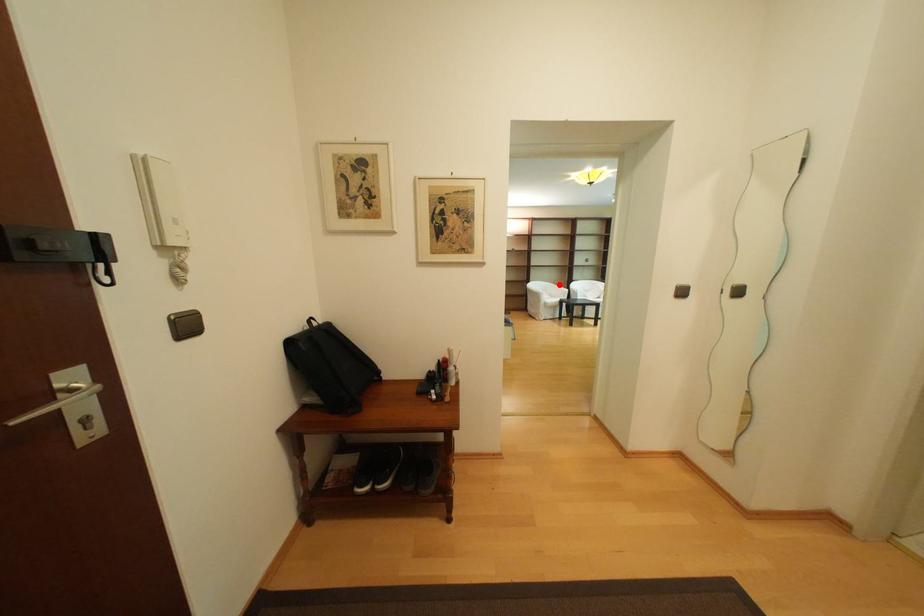
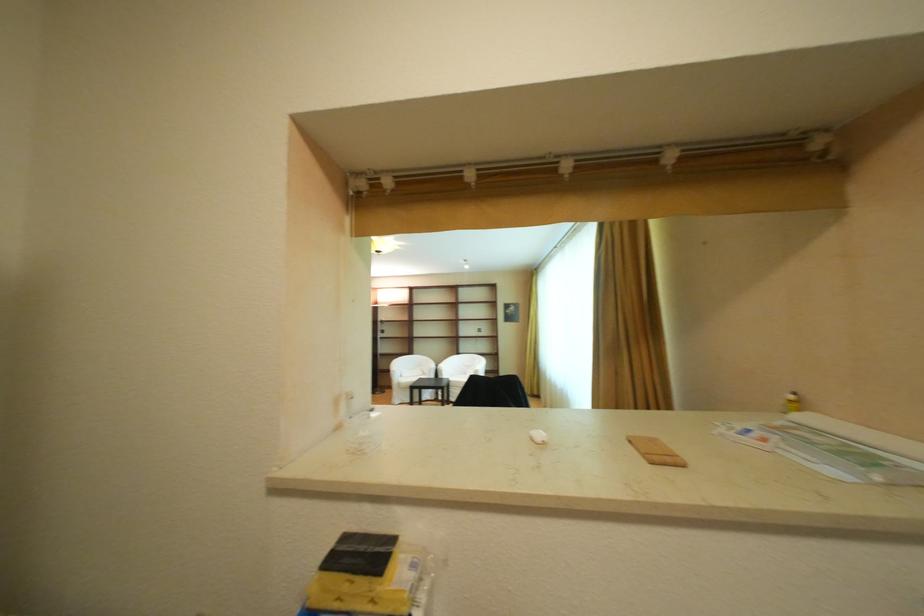
The point at the highlighted location is marked in the first image. Where is the corresponding point in the second image?

(436, 359)